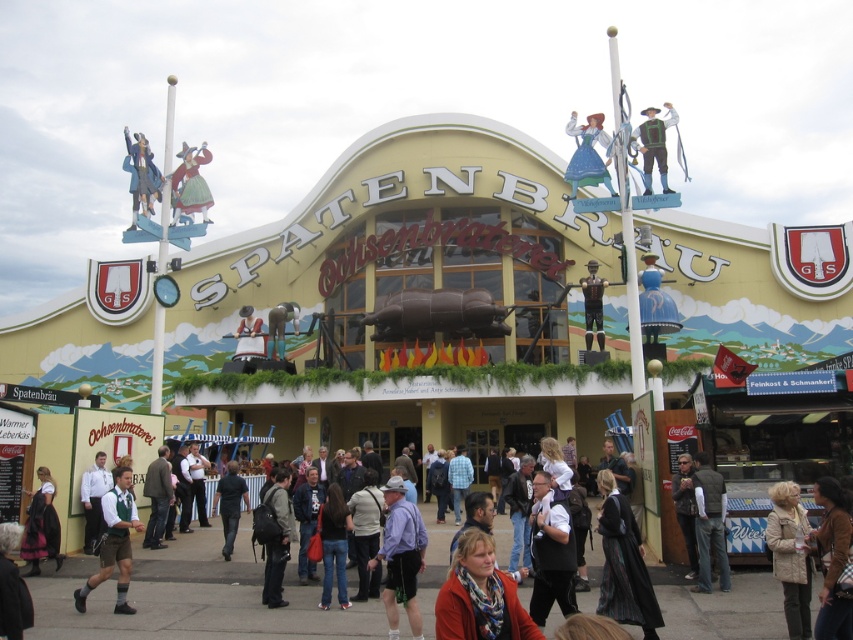
Based on the photo, you are a photographer standing in front of the SPATENBRAEU building. You notice a matte black jacket at lower left and a green fabric shirt at center. Which clothing item appears taller in the photo?

The matte black jacket at lower left appears taller than the green fabric shirt at center because it is much taller as described.